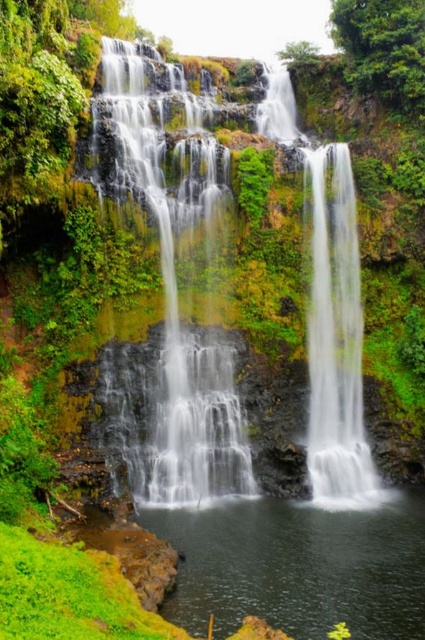
Between clear water at center and smooth gray rock at center, which one has more height?

With more height is smooth gray rock at center.

The height and width of the screenshot is (640, 425). In order to click on clear water at center in this screenshot , I will do `click(299, 566)`.

Between point (316, 552) and point (342, 282), which one is positioned behind?

The point (342, 282) is behind.

The width and height of the screenshot is (425, 640). What are the coordinates of `clear water at center` in the screenshot? It's located at (299, 566).

Is the position of white textured waterfall at center more distant than that of smooth gray rock at center?

No, it is in front of smooth gray rock at center.

Does white textured waterfall at center have a smaller size compared to smooth gray rock at center?

Incorrect, white textured waterfall at center is not smaller in size than smooth gray rock at center.

You are a GUI agent. You are given a task and a screenshot of the screen. Output one action in this format:
    pyautogui.click(x=<x>, y=<y>)
    Task: Click on the white textured waterfall at center
    The width and height of the screenshot is (425, 640).
    Given the screenshot: What is the action you would take?
    pyautogui.click(x=170, y=308)

Can you confirm if white textured waterfall at center is thinner than clear water at center?

Correct, white textured waterfall at center's width is less than clear water at center's.

Is white textured waterfall at center wider than clear water at center?

No.

Does point (238, 483) come in front of point (278, 552)?

No, it is behind (278, 552).

Locate an element on the screen. white textured waterfall at center is located at coordinates (170, 308).